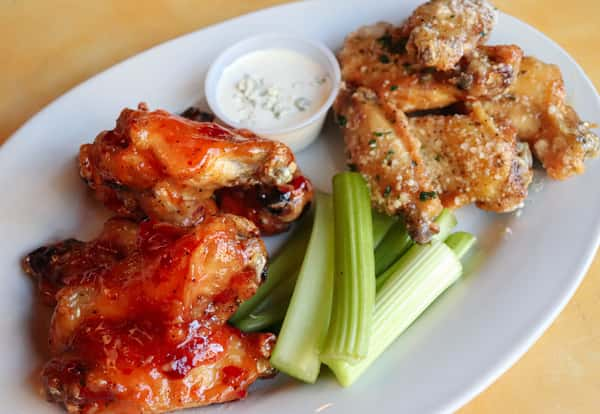
The width and height of the screenshot is (600, 414). Identify the location of white plate. (439, 366).